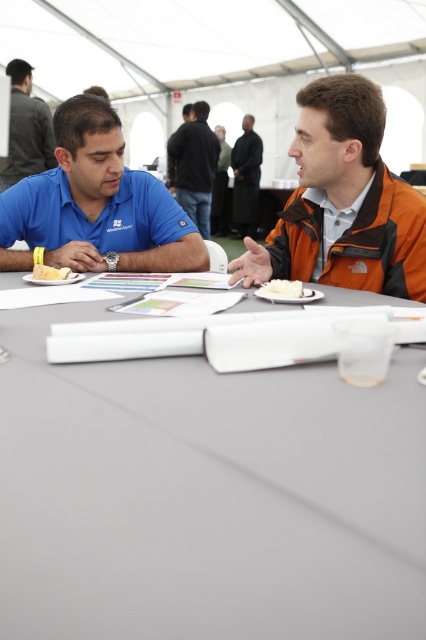
Question: Which point appears farthest from the camera in this image?

Choices:
 (A) (247, 156)
 (B) (207, 173)
 (C) (218, 140)

Answer: (A)

Question: Considering the relative positions of white matte table at center and white fluffy cake at center in the image provided, where is white matte table at center located with respect to white fluffy cake at center?

Choices:
 (A) below
 (B) above

Answer: (A)

Question: Can you confirm if matte blue shirt at upper left is positioned to the right of dark blue shirt at center?

Choices:
 (A) no
 (B) yes

Answer: (A)

Question: Which of the following is the farthest from the observer?

Choices:
 (A) matte blue shirt at left
 (B) white matte table at center
 (C) yellow cake at left

Answer: (A)

Question: From the image, what is the correct spatial relationship of white matte table at center in relation to black leather jacket at center?

Choices:
 (A) right
 (B) left

Answer: (B)

Question: Which of these objects is positioned closest to the black matte suit at center?

Choices:
 (A) matte blue shirt at left
 (B) white fluffy cake at center
 (C) yellow cake at left
 (D) orange softshell jacket at upper right

Answer: (A)